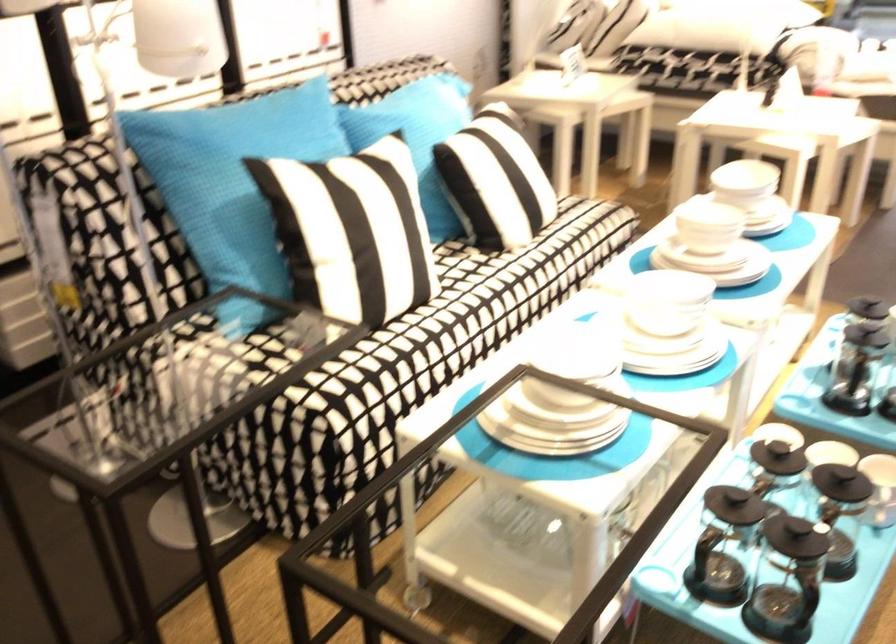
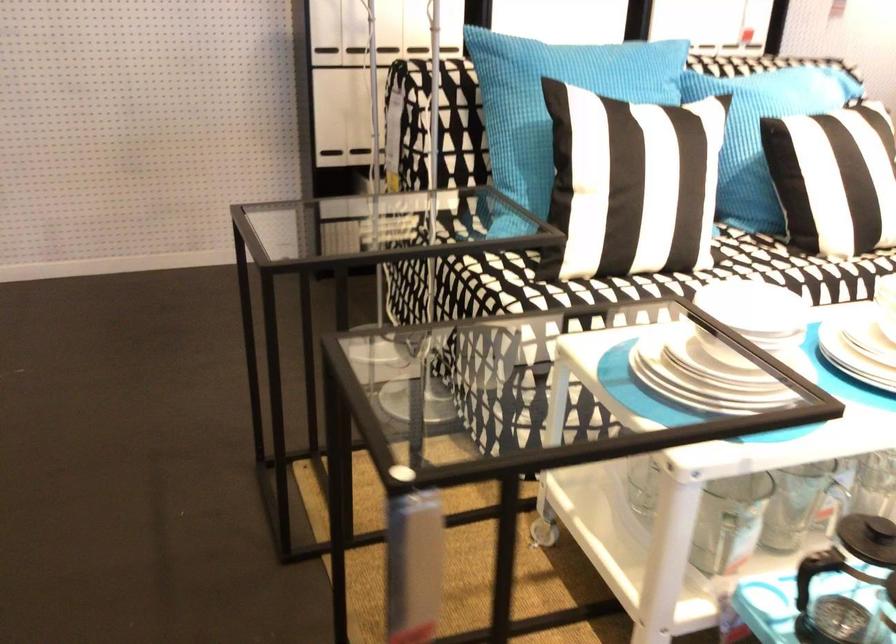
In the second image, find the point that corresponds to the point at 354,245 in the first image.

(617, 180)